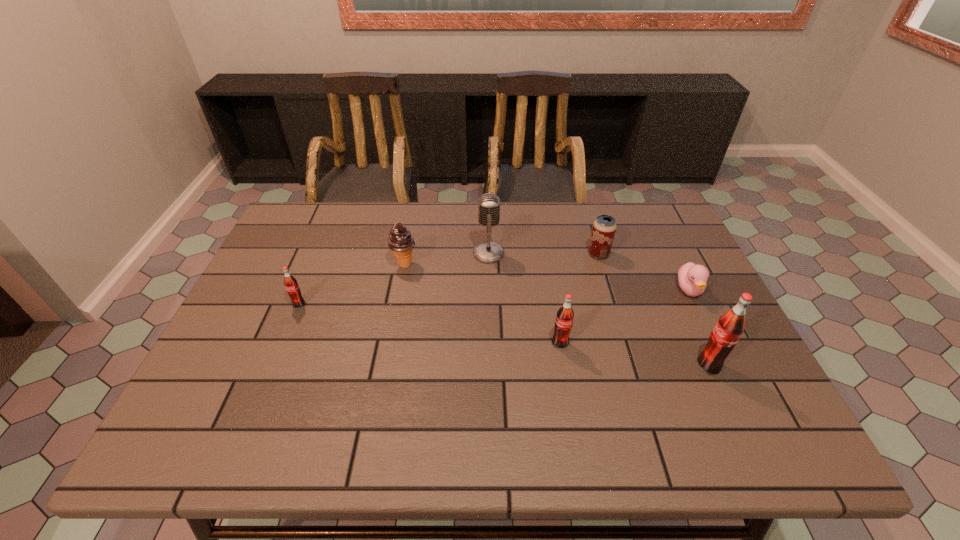
Locate an element on the screen. vacant space that's between the sixth farthest object and the second object from left to right is located at coordinates (482, 304).

At what (x,y) coordinates should I click in order to perform the action: click on free point between the shortest object and the third object from right to left. Please return your answer as a coordinate pair (x, y). This screenshot has height=540, width=960. Looking at the image, I should click on (644, 272).

Identify the location of free spot between the farthest soda bottle and the duckling. (494, 298).

The height and width of the screenshot is (540, 960). I want to click on the fifth closest object to the shortest soda bottle, so click(730, 326).

Locate an element on the screen. object identified as the second closest to the tallest soda bottle is located at coordinates (564, 319).

Identify the location of soda bottle that can be found as the closest to the fifth object from right to left. The height and width of the screenshot is (540, 960). (564, 319).

Point out which soda bottle is positioned as the second nearest to the nearest object. Please provide its 2D coordinates. Your answer should be formatted as a tuple, i.e. [(x, y)], where the tuple contains the x and y coordinates of a point satisfying the conditions above.

[(291, 285)]